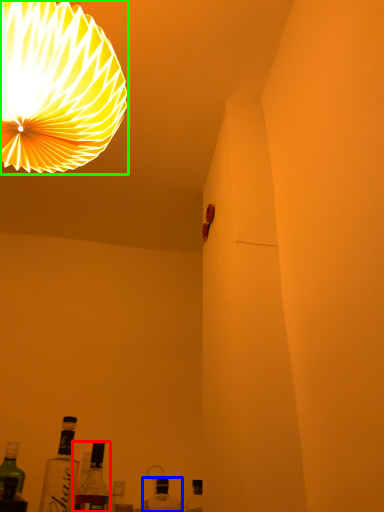
Question: Considering the real-world distances, which object is farthest from bottle (highlighted by a red box)? bottle (highlighted by a blue box) or lamp (highlighted by a green box)?

Choices:
 (A) bottle
 (B) lamp

Answer: (B)